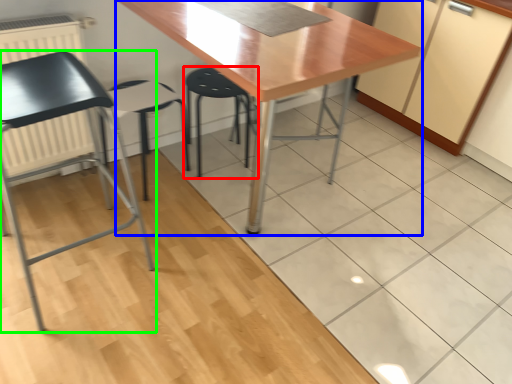
Question: Which object is the farthest from step stool (highlighted by a red box)? Choose among these: table (highlighted by a blue box) or chair (highlighted by a green box).

Choices:
 (A) table
 (B) chair

Answer: (A)